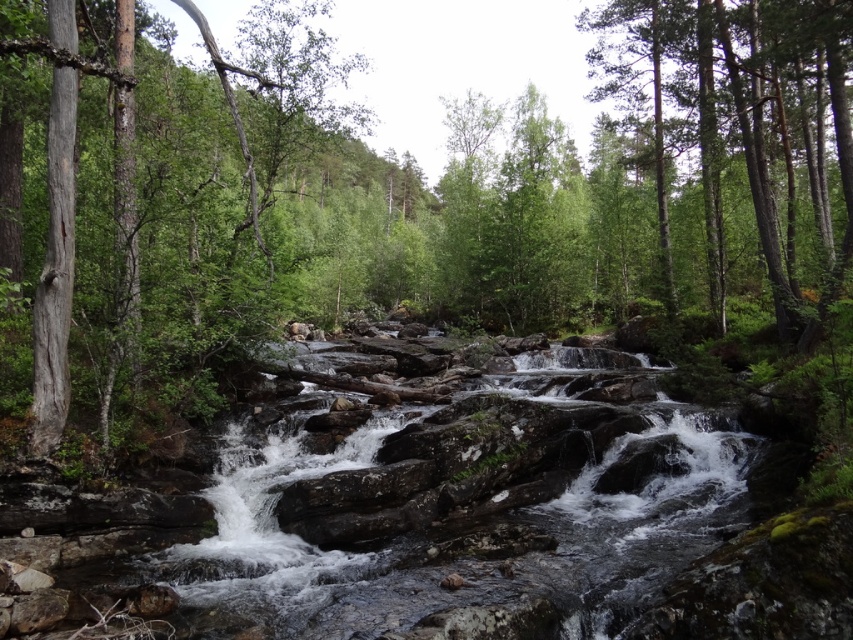
Question: Does green leafy forest at center appear under green smooth tree at upper right?

Choices:
 (A) no
 (B) yes

Answer: (B)

Question: Which object is the closest to the green smooth tree at upper right?

Choices:
 (A) smooth bark tree at left
 (B) green leafy forest at center

Answer: (B)

Question: Which object is closer to the camera taking this photo?

Choices:
 (A) smooth bark tree at left
 (B) green leafy forest at center

Answer: (B)

Question: Does green leafy forest at center have a greater width compared to green smooth tree at upper right?

Choices:
 (A) no
 (B) yes

Answer: (B)

Question: Does smooth bark tree at left appear on the right side of green smooth tree at upper right?

Choices:
 (A) yes
 (B) no

Answer: (B)

Question: Which object appears closest to the camera in this image?

Choices:
 (A) green smooth tree at upper right
 (B) green leafy forest at center

Answer: (B)